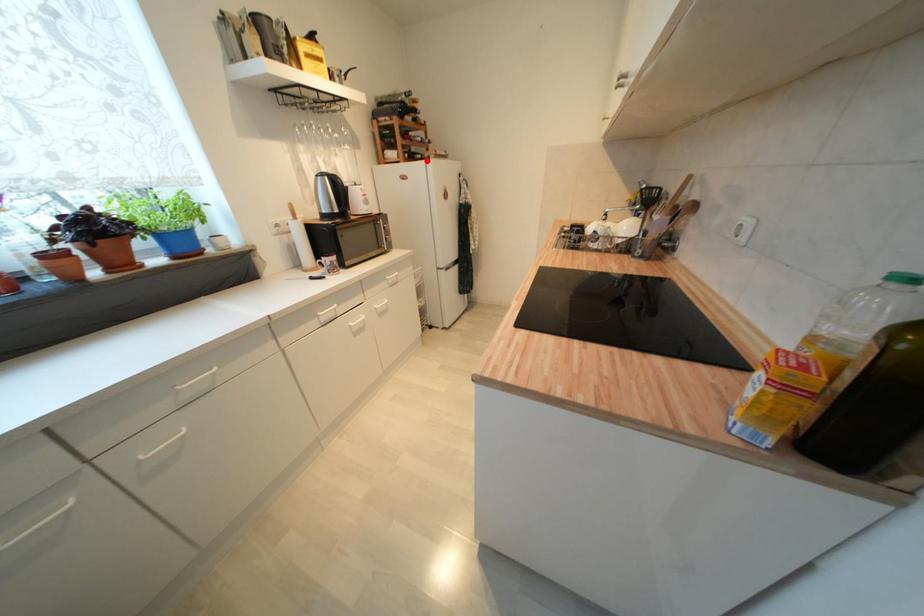
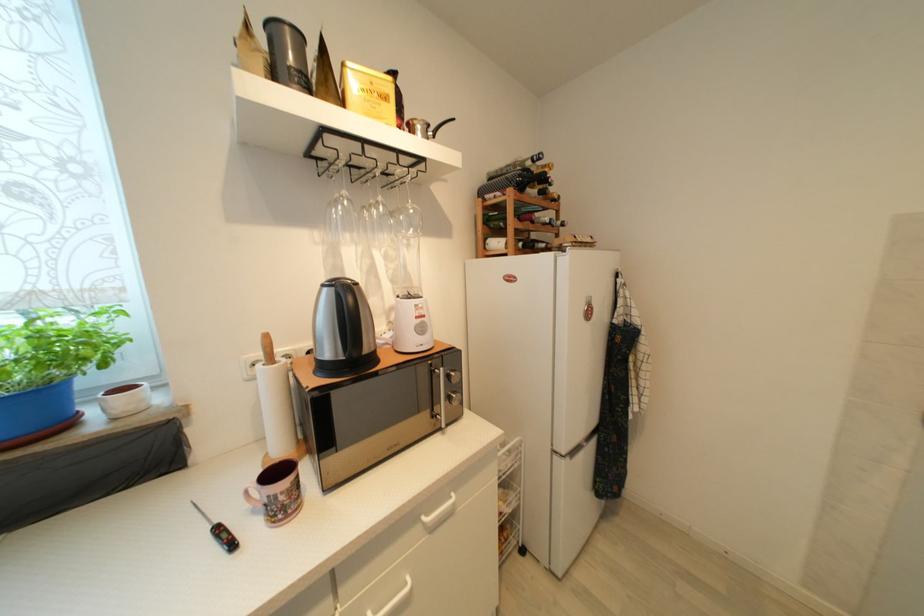
The point at the highlighted location is marked in the first image. Where is the corresponding point in the second image?

(553, 251)